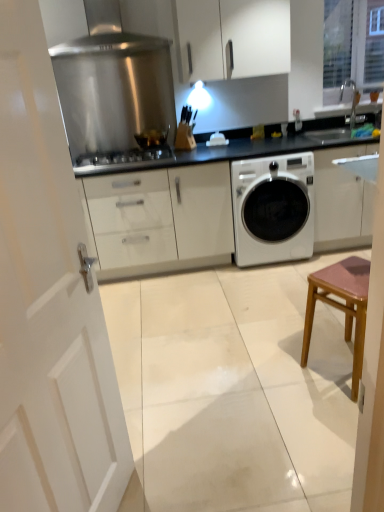
Question: From a real-world perspective, is polished stainless steel range hood at upper center positioned under stainless steel gas stove at center based on gravity?

Choices:
 (A) yes
 (B) no

Answer: (B)

Question: Could you tell me if polished stainless steel range hood at upper center is turned towards stainless steel gas stove at center?

Choices:
 (A) yes
 (B) no

Answer: (A)

Question: Is polished stainless steel range hood at upper center in contact with stainless steel gas stove at center?

Choices:
 (A) no
 (B) yes

Answer: (A)

Question: From the image's perspective, is polished stainless steel range hood at upper center below stainless steel gas stove at center?

Choices:
 (A) yes
 (B) no

Answer: (B)

Question: Considering the relative positions of polished stainless steel range hood at upper center and stainless steel gas stove at center in the image provided, is polished stainless steel range hood at upper center to the right of stainless steel gas stove at center from the viewer's perspective?

Choices:
 (A) yes
 (B) no

Answer: (B)

Question: Considering the relative sizes of polished stainless steel range hood at upper center and stainless steel gas stove at center in the image provided, is polished stainless steel range hood at upper center shorter than stainless steel gas stove at center?

Choices:
 (A) no
 (B) yes

Answer: (A)

Question: Considering the relative sizes of black glossy sink at upper right and white matte washing machine at center in the image provided, is black glossy sink at upper right thinner than white matte washing machine at center?

Choices:
 (A) yes
 (B) no

Answer: (A)

Question: From the image's perspective, is black glossy sink at upper right beneath white matte washing machine at center?

Choices:
 (A) no
 (B) yes

Answer: (A)

Question: Does black glossy sink at upper right have a smaller size compared to white matte washing machine at center?

Choices:
 (A) no
 (B) yes

Answer: (B)

Question: Does black glossy sink at upper right have a larger size compared to white matte washing machine at center?

Choices:
 (A) yes
 (B) no

Answer: (B)

Question: Does black glossy sink at upper right appear on the right side of white matte washing machine at center?

Choices:
 (A) yes
 (B) no

Answer: (A)

Question: Is black glossy sink at upper right positioned before white matte washing machine at center?

Choices:
 (A) yes
 (B) no

Answer: (B)

Question: Is there a large distance between stainless steel gas stove at center and stainless steel exhaust hood at upper center?

Choices:
 (A) no
 (B) yes

Answer: (A)